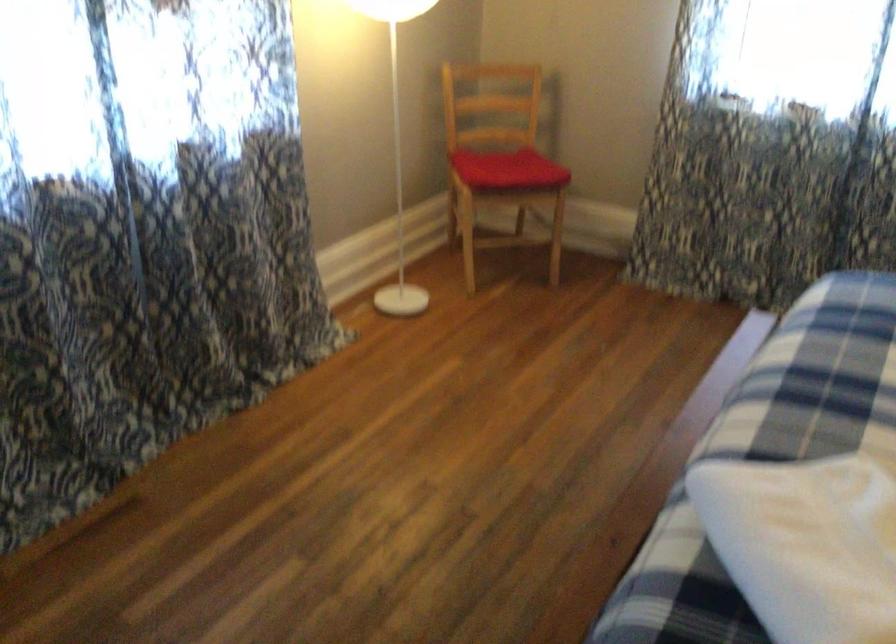
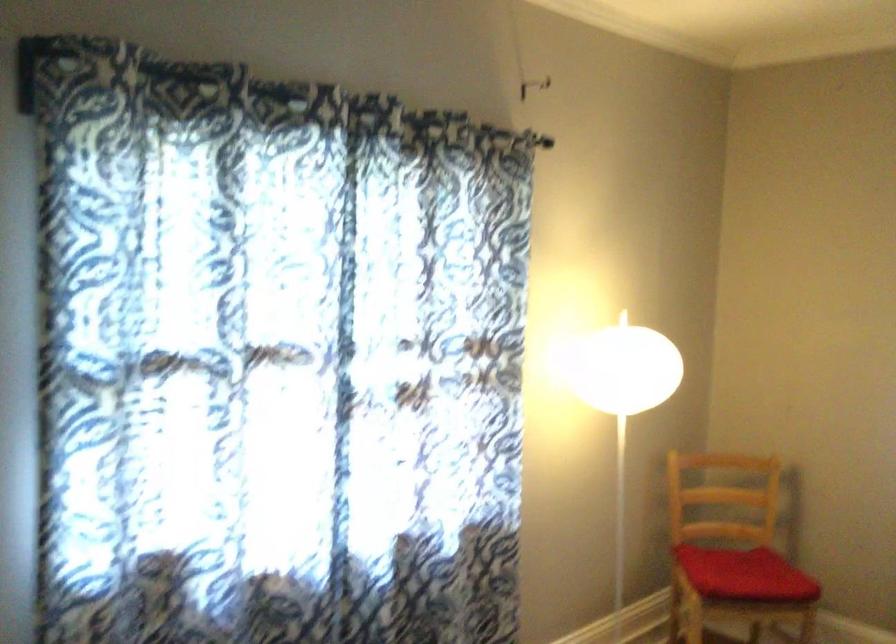
Where in the second image is the point corresponding to point 504,173 from the first image?

(745, 574)